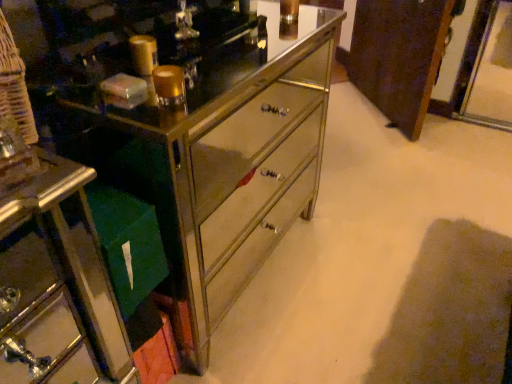
Find the location of a particular element. Image resolution: width=512 pixels, height=384 pixels. unoccupied region to the right of metallic mirrored chest of drawers at center is located at coordinates (382, 260).